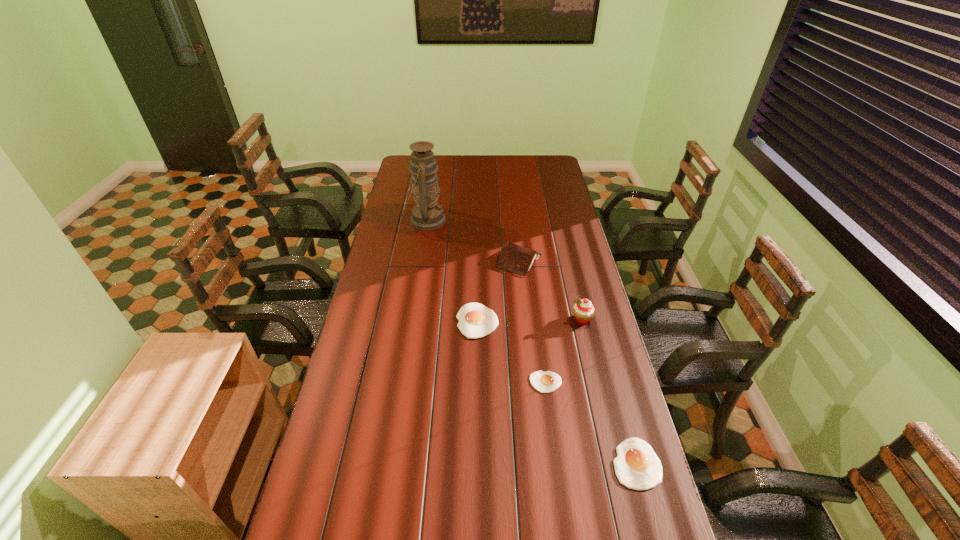
Where is `free space located on the back of the farthest egg yolk`? This screenshot has width=960, height=540. free space located on the back of the farthest egg yolk is located at coordinates (477, 280).

This screenshot has width=960, height=540. Find the location of `vacant space located 0.180m on the front of the fifth farthest object`. vacant space located 0.180m on the front of the fifth farthest object is located at coordinates (554, 448).

This screenshot has height=540, width=960. What are the coordinates of `free space located on the back of the second shortest object` in the screenshot? It's located at (608, 358).

Identify the location of vacant space located 0.240m on the front of the book. (526, 320).

At what (x,y) coordinates should I click in order to perform the action: click on vacant area located 0.110m on the right of the farthest object. Please return your answer as a coordinate pair (x, y). Image resolution: width=960 pixels, height=540 pixels. Looking at the image, I should click on (468, 220).

Where is `vacant region located 0.350m on the left of the second tallest object`? vacant region located 0.350m on the left of the second tallest object is located at coordinates (475, 319).

Locate an element on the screen. This screenshot has height=540, width=960. object that is at the near edge is located at coordinates (637, 466).

Where is `object that is at the left edge`? The image size is (960, 540). object that is at the left edge is located at coordinates [x=427, y=215].

Where is `egg yolk located in the right edge section of the desktop`? This screenshot has width=960, height=540. egg yolk located in the right edge section of the desktop is located at coordinates (637, 466).

The height and width of the screenshot is (540, 960). What are the coordinates of `cupcake located in the right edge section of the desktop` in the screenshot? It's located at (583, 310).